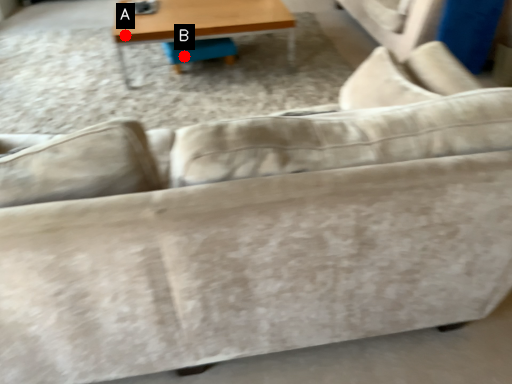
Question: Two points are circled on the image, labeled by A and B beside each circle. Which point appears farthest from the camera in this image?

Choices:
 (A) A is further
 (B) B is further

Answer: (B)